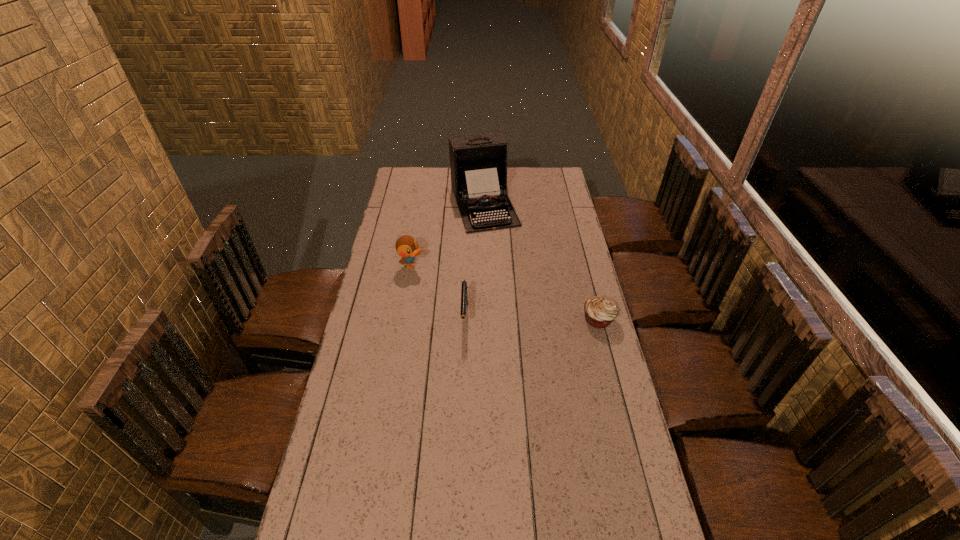
You are a GUI agent. You are given a task and a screenshot of the screen. Output one action in this format:
    pyautogui.click(x=<x>, y=<y>)
    Task: Click on the vacant space on the desktop that is between the pistol and the rightmost object and is positioned on the front-facing side of the duck
    The image size is (960, 540).
    Given the screenshot: What is the action you would take?
    pyautogui.click(x=517, y=318)

The image size is (960, 540). Find the location of `vacant spot on the desktop that is between the pistol and the muffin and is positioned inside the open case of the farthest object`. vacant spot on the desktop that is between the pistol and the muffin and is positioned inside the open case of the farthest object is located at coordinates (530, 318).